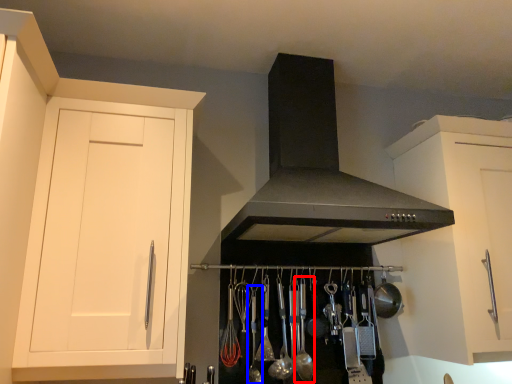
Question: Among these objects, which one is farthest to the camera, utensil (highlighted by a red box) or utensil (highlighted by a blue box)?

Choices:
 (A) utensil
 (B) utensil

Answer: (A)